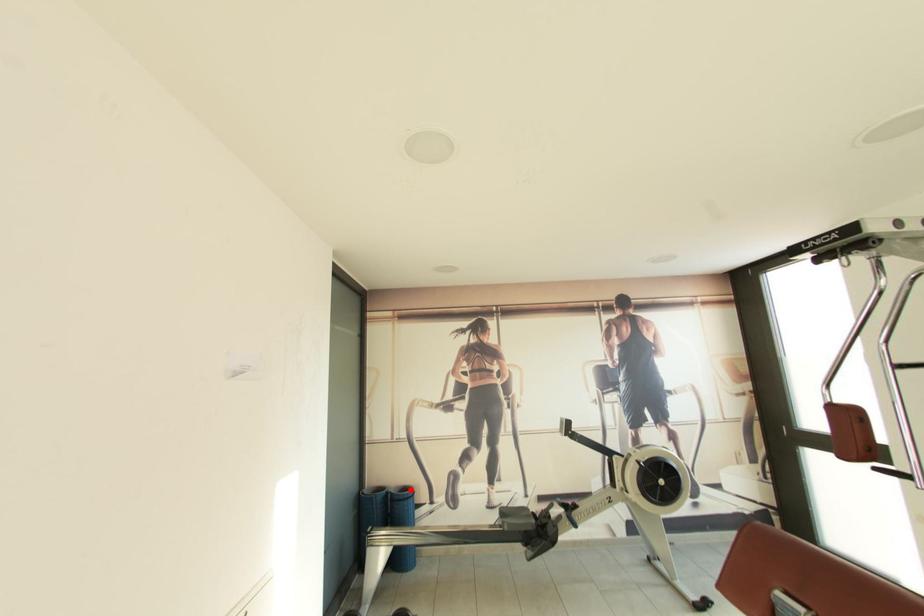
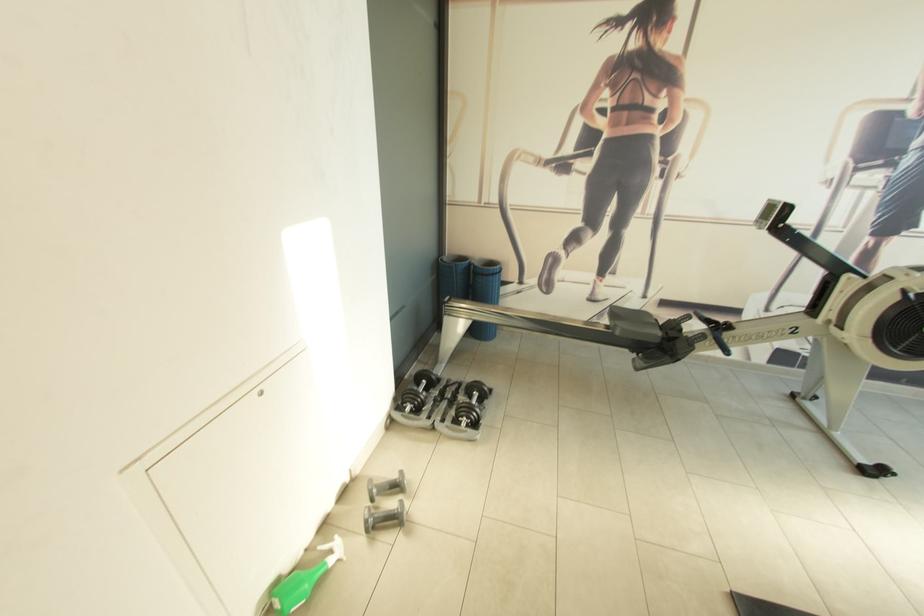
Question: I am providing you with two images of the same scene from different viewpoints. Given a red point in image1, look at the same physical point in image2. Is it:

Choices:
 (A) Closer to the viewpoint
 (B) Farther from the viewpoint

Answer: (A)